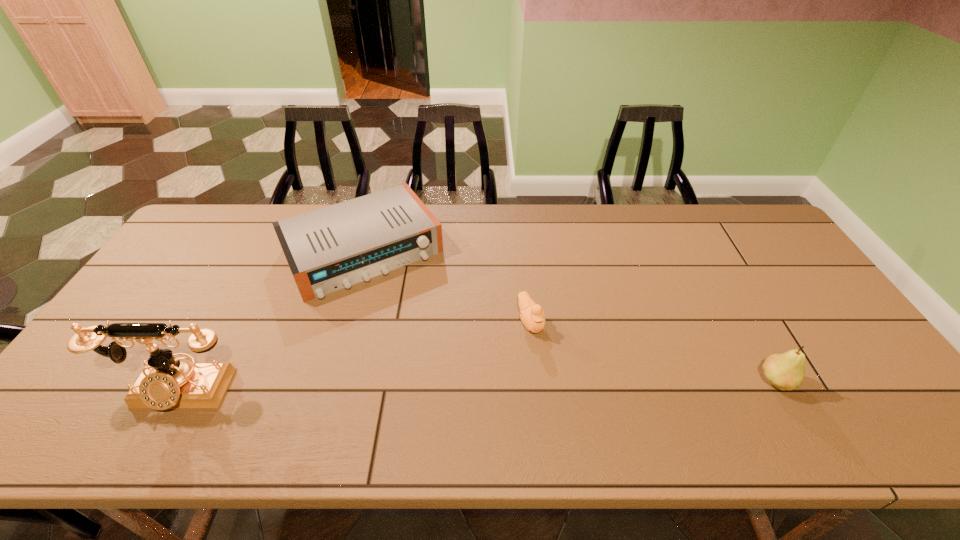
The image size is (960, 540). I want to click on vacant space on the desktop that is between the telephone and the rightmost object and is positioned on the control panel of the radio receiver, so click(445, 388).

The height and width of the screenshot is (540, 960). I want to click on vacant space on the desktop that is between the tallest object and the third shortest object and is positioned on the face of the third object from left to right, so click(565, 386).